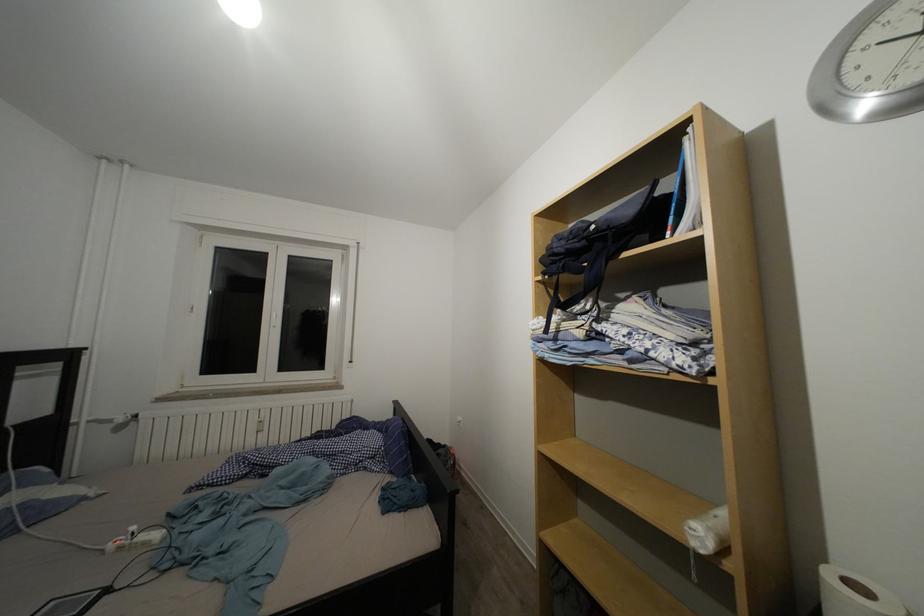
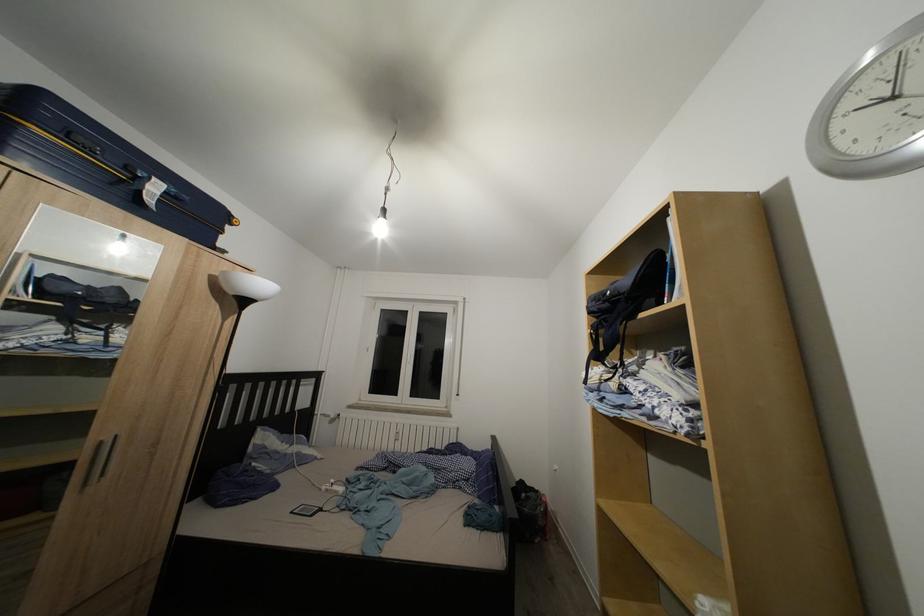
In a continuous first-person perspective shot, in which direction is the camera moving?

The cameraman walked toward right, backward.